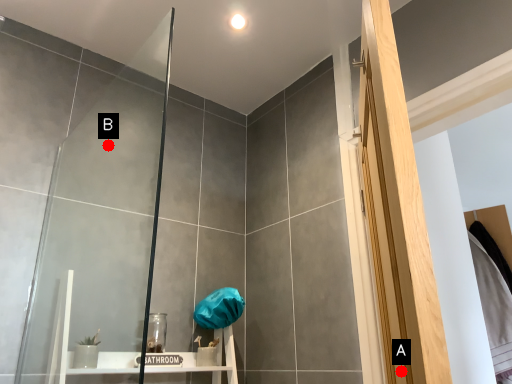
Question: Two points are circled on the image, labeled by A and B beside each circle. Which of the following is the closest to the observer?

Choices:
 (A) A is closer
 (B) B is closer

Answer: (A)